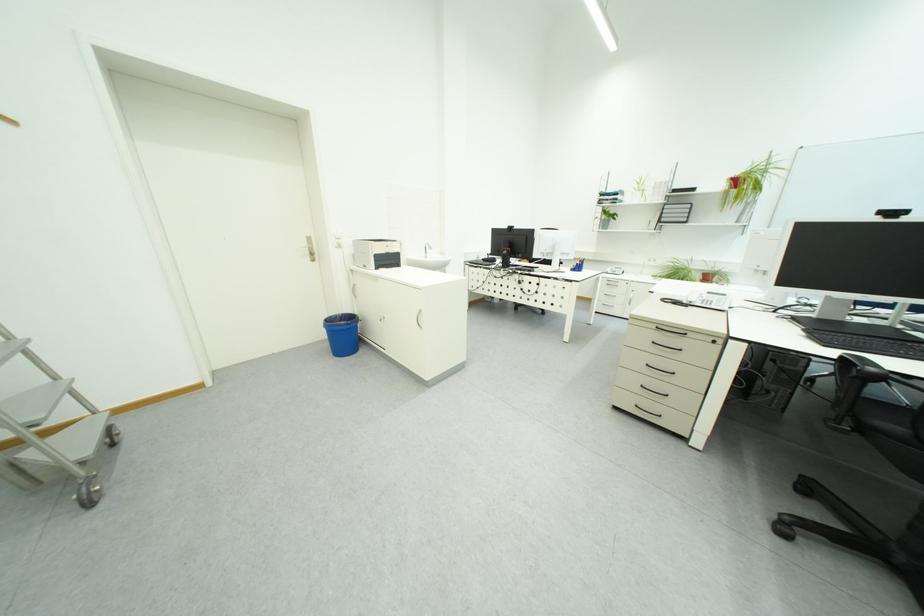
Image resolution: width=924 pixels, height=616 pixels. I want to click on sink faucet handle, so click(427, 249).